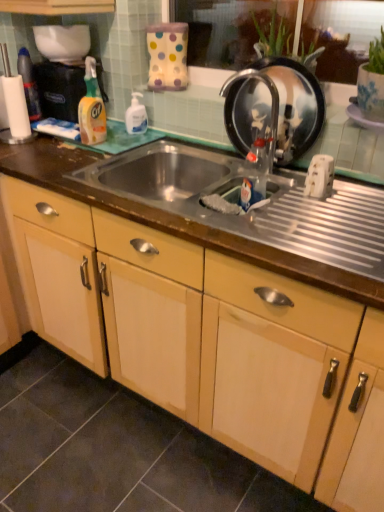
The width and height of the screenshot is (384, 512). Find the location of `free space in front of white glossy pump bottle at upper center, which is the 1th cleaning product from right to left`. free space in front of white glossy pump bottle at upper center, which is the 1th cleaning product from right to left is located at coordinates tap(126, 141).